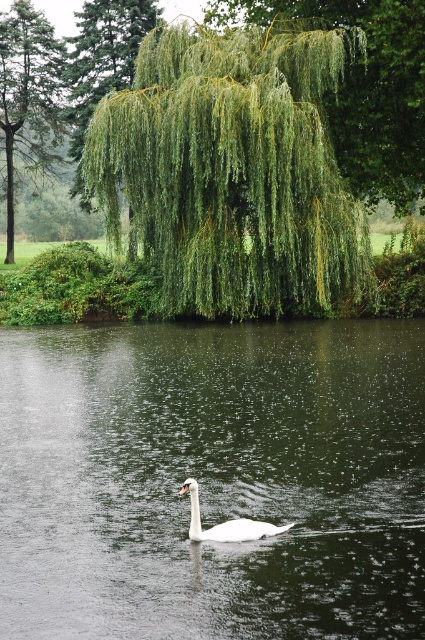
Between clear water at center and green leafy tree at upper left, which one appears on the right side from the viewer's perspective?

clear water at center

Can you confirm if clear water at center is positioned above green leafy tree at upper left?

No, clear water at center is not above green leafy tree at upper left.

Image resolution: width=425 pixels, height=640 pixels. What do you see at coordinates (212, 480) in the screenshot?
I see `clear water at center` at bounding box center [212, 480].

Image resolution: width=425 pixels, height=640 pixels. Identify the location of clear water at center. (212, 480).

Looking at this image, measure the distance between green leafy willow at upper center and green leafy tree at upper center.

green leafy willow at upper center is 4.25 meters from green leafy tree at upper center.

From the picture: Can you confirm if green leafy willow at upper center is wider than green leafy tree at upper center?

No.

This screenshot has width=425, height=640. I want to click on green leafy willow at upper center, so click(x=232, y=172).

Identify the location of green leafy willow at upper center. (232, 172).

Who is more forward, (411, 45) or (23, 67)?

Point (411, 45) is more forward.

Find the location of a particular element. This screenshot has height=640, width=425. green leafy tree at upper center is located at coordinates (363, 88).